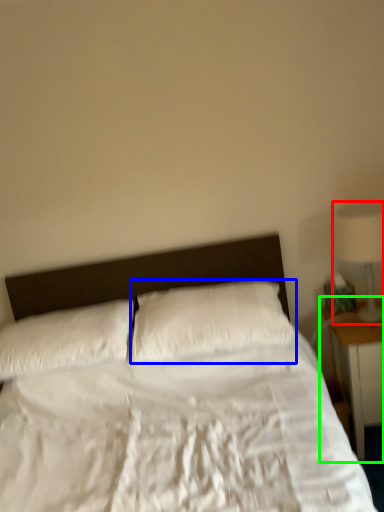
Question: Which object is the closest to the lamp (highlighted by a red box)? Choose among these: pillow (highlighted by a blue box) or nightstand (highlighted by a green box).

Choices:
 (A) pillow
 (B) nightstand

Answer: (B)